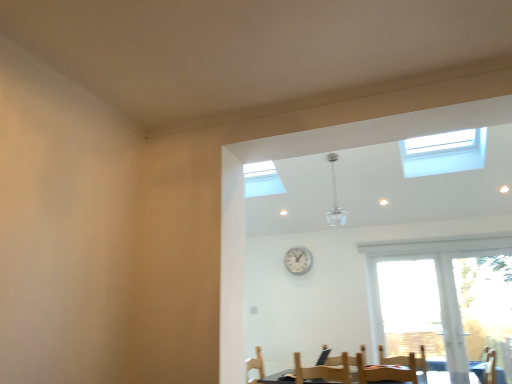
In order to face wooden chair at lower center, should I rotate leftwards or rightwards?

To align with it, rotate right about 16.476°.

This screenshot has width=512, height=384. Describe the element at coordinates (386, 373) in the screenshot. I see `wooden chair at lower center` at that location.

Identify the location of silver metallic clock at center. (298, 260).

In order to click on wooden armchair at lower right in this screenshot , I will do `click(392, 358)`.

Where is `wooden chair at lower center`? wooden chair at lower center is located at coordinates (386, 373).

From the picture: From the image's perspective, is wooden armchair at lower right under silver metallic clock at center?

Correct, wooden armchair at lower right appears lower than silver metallic clock at center in the image.

Is silver metallic clock at center at the back of wooden armchair at lower right?

wooden armchair at lower right is not turned away from silver metallic clock at center.

At what (x,y) coordinates should I click in order to perform the action: click on armchair that is on the right side of silver metallic clock at center. Please return your answer as a coordinate pair (x, y). This screenshot has width=512, height=384. Looking at the image, I should click on (392, 358).

From a real-world perspective, which is physically above, wooden chair at lower center or silver metallic clock at center?

silver metallic clock at center, from a real-world perspective.

Consider the image. Is wooden chair at lower center in front of silver metallic clock at center?

Yes, the depth of wooden chair at lower center is less than that of silver metallic clock at center.

Are wooden chair at lower center and silver metallic clock at center far apart?

That's right, there is a large distance between wooden chair at lower center and silver metallic clock at center.

From a real-world perspective, is silver metallic clock at center located beneath wooden chair at lower center?

No, from a real-world perspective, silver metallic clock at center is not under wooden chair at lower center.

Could you tell me if silver metallic clock at center is facing wooden chair at lower center?

No, silver metallic clock at center is not turned towards wooden chair at lower center.

From the image's perspective, which one is positioned lower, silver metallic clock at center or wooden chair at lower center?

wooden chair at lower center appears lower in the image.

Considering the relative sizes of silver metallic clock at center and wooden chair at lower center in the image provided, is silver metallic clock at center smaller than wooden chair at lower center?

Yes, silver metallic clock at center is smaller than wooden chair at lower center.

Looking at their sizes, would you say silver metallic clock at center is wider or thinner than wooden armchair at lower right?

Clearly, silver metallic clock at center has less width compared to wooden armchair at lower right.

Is wooden armchair at lower right at the back of silver metallic clock at center?

No, silver metallic clock at center is not facing the opposite direction of wooden armchair at lower right.

Is wooden armchair at lower right a part of silver metallic clock at center?

No, wooden armchair at lower right is not a part of silver metallic clock at center.

Find the location of a particular element. This screenshot has height=384, width=512. clock above the wooden armchair at lower right (from the image's perspective) is located at coordinates (298, 260).

Between wooden chair at lower center and wooden armchair at lower right, which one has smaller size?

wooden chair at lower center.

Between wooden chair at lower center and wooden armchair at lower right, which one has larger width?

wooden armchair at lower right.

Where is `chair lying above the wooden armchair at lower right (from the image's perspective)`? The image size is (512, 384). chair lying above the wooden armchair at lower right (from the image's perspective) is located at coordinates (386, 373).

Is wooden chair at lower center inside the boundaries of wooden armchair at lower right, or outside?

The correct answer is: outside.

From the image's perspective, between wooden armchair at lower right and wooden chair at lower center, who is located below?

wooden armchair at lower right, from the image's perspective.

From a real-world perspective, is wooden armchair at lower right physically located above or below wooden chair at lower center?

wooden armchair at lower right is situated higher than wooden chair at lower center in the real world.

From the picture: Between wooden armchair at lower right and wooden chair at lower center, which one has larger size?

wooden armchair at lower right is bigger.

Considering the relative positions of wooden armchair at lower right and wooden chair at lower center in the image provided, is wooden armchair at lower right behind wooden chair at lower center?

Yes, wooden armchair at lower right is behind wooden chair at lower center.

Locate an element on the screen. clock located above the wooden armchair at lower right (from a real-world perspective) is located at coordinates [x=298, y=260].

At what (x,y) coordinates should I click in order to perform the action: click on clock on the left of wooden chair at lower center. Please return your answer as a coordinate pair (x, y). Looking at the image, I should click on (298, 260).

From the image, which object appears to be nearer to wooden armchair at lower right, wooden chair at lower center or silver metallic clock at center?

Based on the image, wooden chair at lower center appears to be nearer to wooden armchair at lower right.

Considering their positions, is wooden armchair at lower right positioned further to wooden chair at lower center than silver metallic clock at center?

silver metallic clock at center lies further to wooden chair at lower center than the other object.

Based on their spatial positions, is wooden chair at lower center or wooden armchair at lower right further from silver metallic clock at center?

wooden chair at lower center lies further to silver metallic clock at center than the other object.

In the scene shown: Estimate the real-world distances between objects in this image. Which object is further from wooden chair at lower center, silver metallic clock at center or wooden armchair at lower right?

silver metallic clock at center lies further to wooden chair at lower center than the other object.

Estimate the real-world distances between objects in this image. Which object is further from wooden armchair at lower right, silver metallic clock at center or wooden chair at lower center?

silver metallic clock at center.

Considering their positions, is wooden armchair at lower right positioned further to silver metallic clock at center than wooden chair at lower center?

The object further to silver metallic clock at center is wooden chair at lower center.

You are a GUI agent. You are given a task and a screenshot of the screen. Output one action in this format:
    pyautogui.click(x=<x>, y=<y>)
    Task: Click on the armchair positioned between wooden chair at lower center and silver metallic clock at center from near to far
    
    Given the screenshot: What is the action you would take?
    pyautogui.click(x=392, y=358)